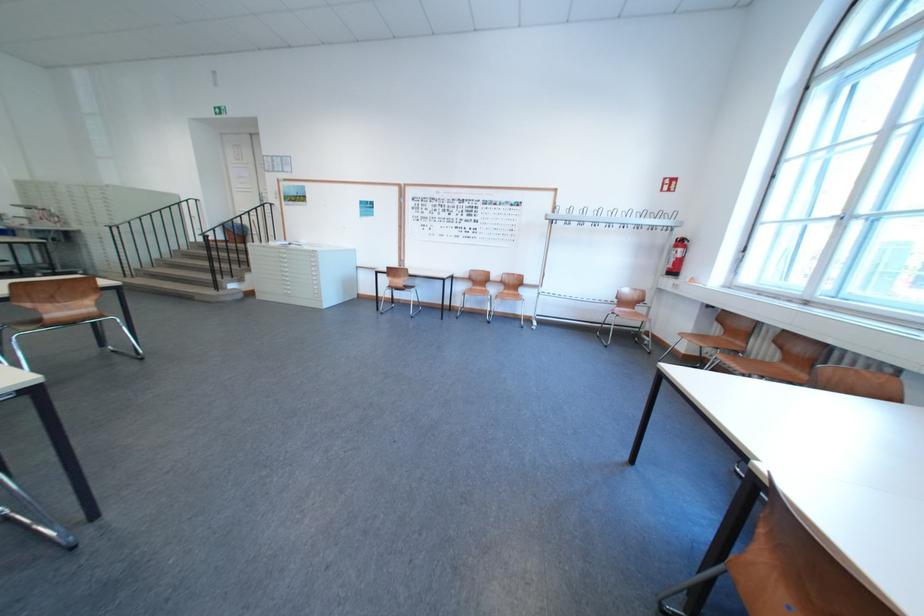
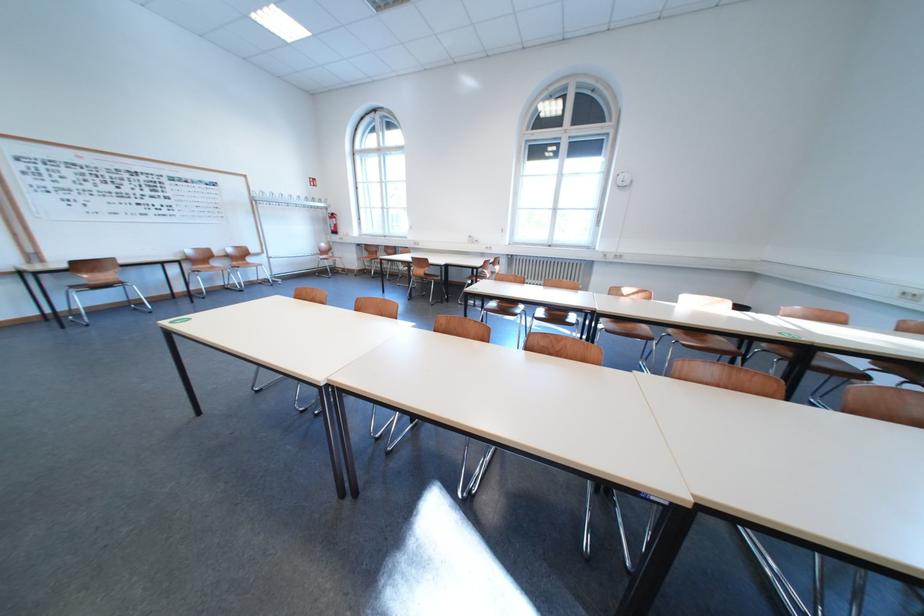
The point at (520, 294) is marked in the first image. Where is the corresponding point in the second image?

(249, 265)